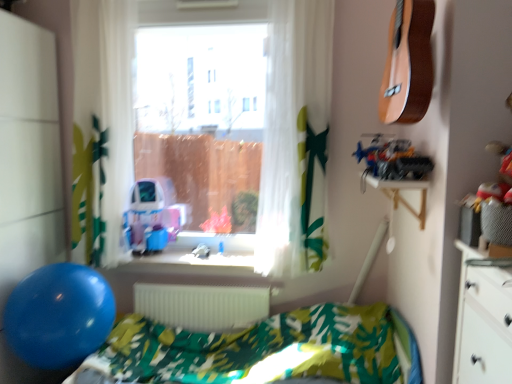
Identify the location of vacant region above white matte radiator at center (from a real-world perspective). This screenshot has width=512, height=384. (215, 283).